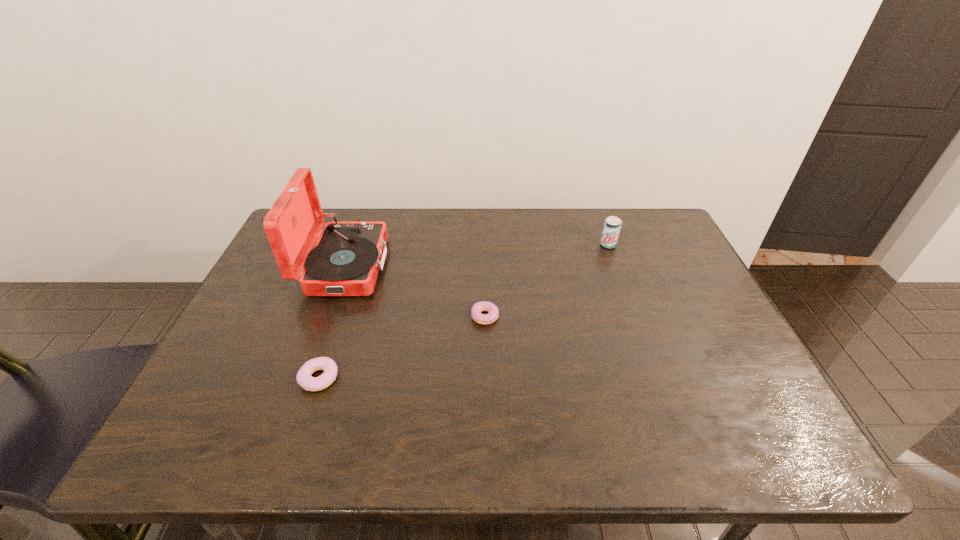
Find the location of `vacant space located 0.280m on the left of the third object from left to right`. vacant space located 0.280m on the left of the third object from left to right is located at coordinates (361, 316).

You are a GUI agent. You are given a task and a screenshot of the screen. Output one action in this format:
    pyautogui.click(x=<x>, y=<y>)
    Task: Click on the phonograph_record at the far edge
    The width and height of the screenshot is (960, 540).
    Given the screenshot: What is the action you would take?
    pyautogui.click(x=345, y=261)

This screenshot has height=540, width=960. Find the location of `beer can that is at the far edge`. beer can that is at the far edge is located at coordinates (612, 226).

Image resolution: width=960 pixels, height=540 pixels. I want to click on object situated at the left edge, so click(345, 261).

Identify the location of object that is at the far left corner. (345, 261).

The width and height of the screenshot is (960, 540). I want to click on vacant space at the far edge of the desktop, so click(519, 251).

In the image, there is a desktop. Identify the location of free space at the near edge. (435, 443).

What are the coordinates of `blank space at the left edge` in the screenshot? It's located at (256, 309).

In order to click on free region at the right edge of the desktop in this screenshot , I will do `click(737, 347)`.

This screenshot has width=960, height=540. Find the location of `vacant space at the far right corner of the desktop`. vacant space at the far right corner of the desktop is located at coordinates pos(624,215).